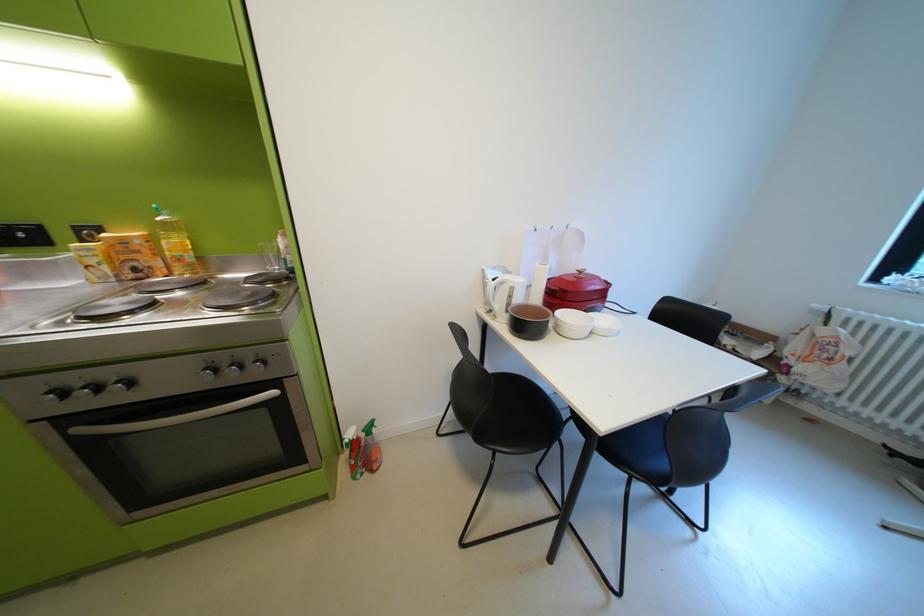
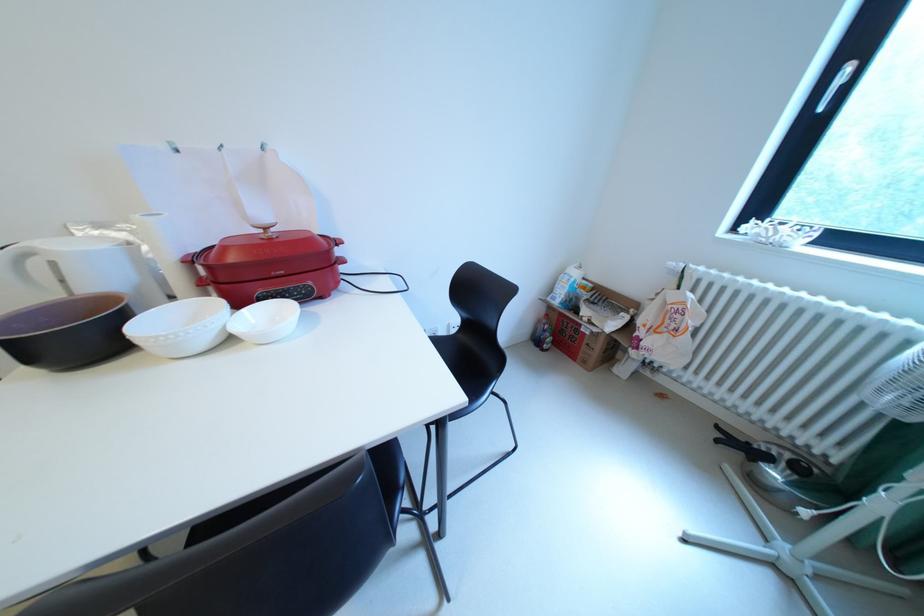
Where in the second image is the point corresponding to (833,331) from the first image?

(682, 297)